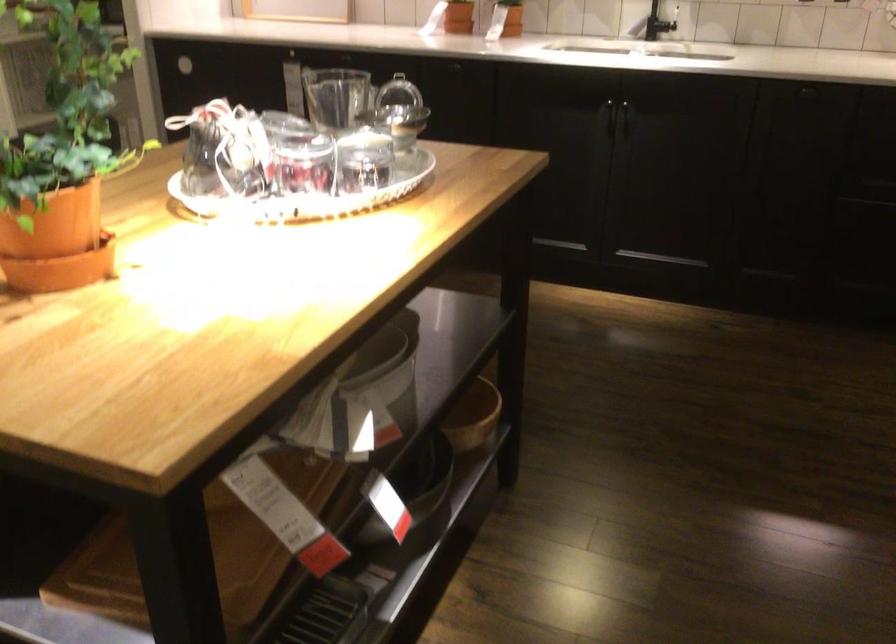
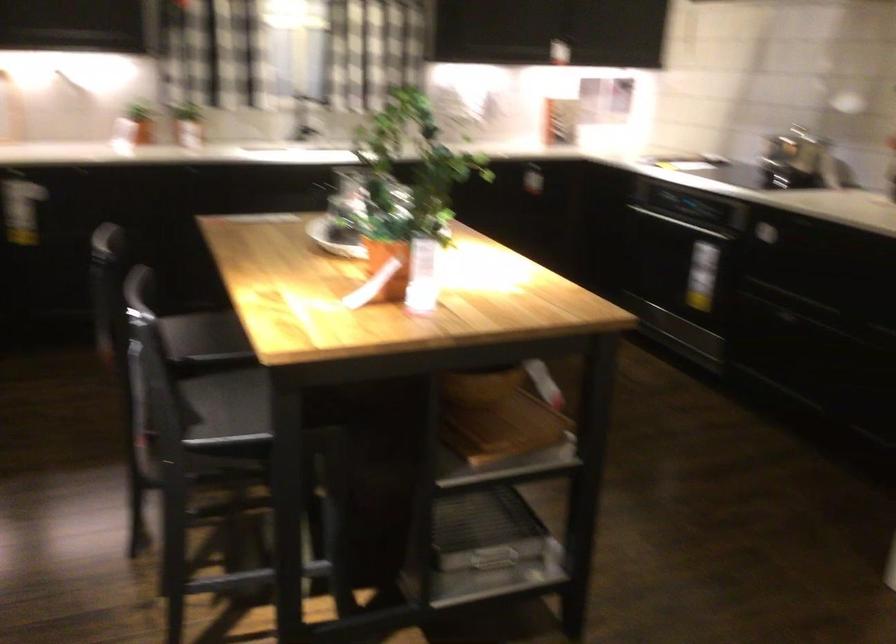
Question: I am providing you with two images of the same scene from different viewpoints. After the viewpoint changes to image2, which objects are now occluded?

Choices:
 (A) orange plant pot
 (B) white bucket
 (C) second drawer lip
 (D) black chair sitting surface

Answer: (B)